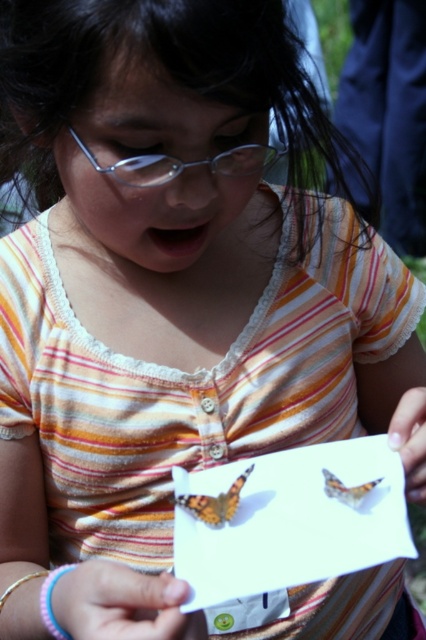
Question: Can you confirm if clear plastic glasses at center is smaller than orange patterned butterfly at center?

Choices:
 (A) no
 (B) yes

Answer: (A)

Question: Which object is positioned closest to the clear plastic glasses at center?

Choices:
 (A) orange and black butterfly at center
 (B) orange patterned butterfly at center

Answer: (A)

Question: Which point is closer to the camera?

Choices:
 (A) (339, 490)
 (B) (213, 497)

Answer: (A)

Question: Can you confirm if orange and black butterfly at center is bigger than orange patterned butterfly at center?

Choices:
 (A) yes
 (B) no

Answer: (A)

Question: Observing the image, what is the correct spatial positioning of clear plastic glasses at center in reference to orange and black butterfly at center?

Choices:
 (A) right
 (B) left

Answer: (B)

Question: Which object is closer to the camera taking this photo?

Choices:
 (A) clear plastic glasses at center
 (B) orange and black butterfly at center

Answer: (A)